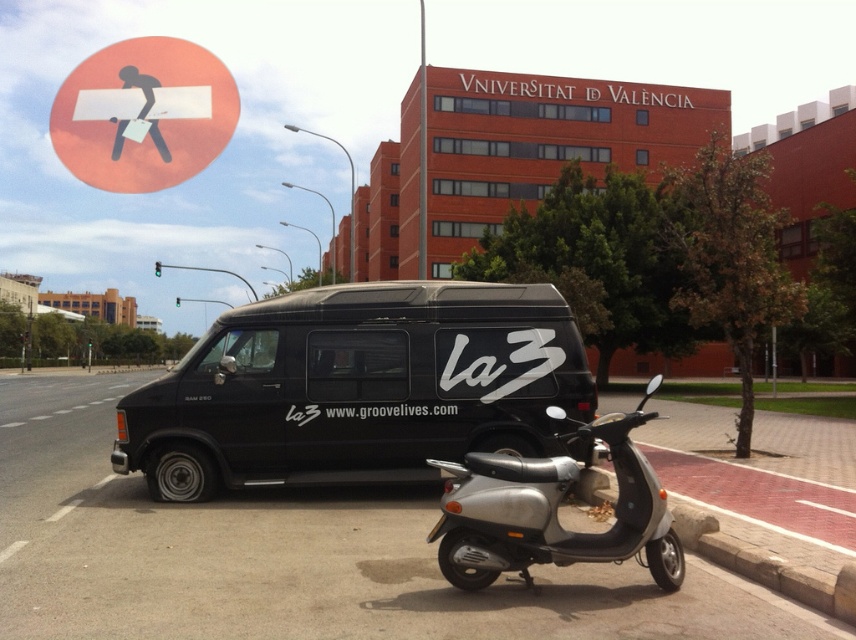
You are a delivery person who needs to park your scooter in a designated area. The designated area is located at the point with coordinates (553, 509). Can you confirm if the silver metallic scooter at center is already parked in the designated area?

The point (553, 509) marks the silver metallic scooter at center, so yes, the silver metallic scooter at center is already parked in the designated area.

You are a delivery driver who needs to park your vehicle between the black matte van at center and the silver metallic scooter at center. Given that your vehicle is 2 meters wide, can you fit your vehicle in the space between them?

The black matte van at center is to the left of the silver metallic scooter at center, but the distance between them is not provided. Therefore, it is impossible to determine if the 2 meter wide vehicle can fit between them.